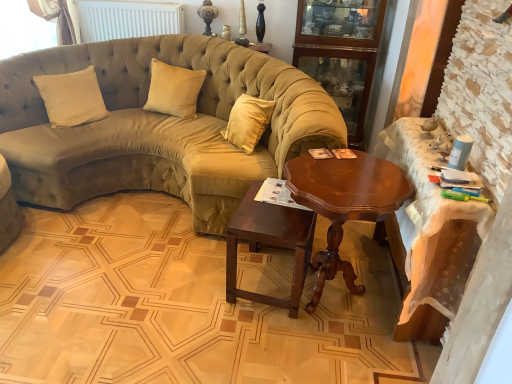
This screenshot has height=384, width=512. What do you see at coordinates (127, 19) in the screenshot?
I see `white matte radiator at upper center` at bounding box center [127, 19].

Identify the location of wooden cabinet at upper right. This screenshot has height=384, width=512. (341, 53).

The image size is (512, 384). Find the location of `velvet olive green couch at center`. velvet olive green couch at center is located at coordinates [159, 126].

Which is more to the left, wooden cabinet at upper right or shiny brown wood coffee table at center?

shiny brown wood coffee table at center.

Measure the distance between wooden cabinet at upper right and shiny brown wood coffee table at center.

1.47 meters.

Is wooden cabinet at upper right positioned beyond the bounds of shiny brown wood coffee table at center?

Yes, wooden cabinet at upper right is located beyond the bounds of shiny brown wood coffee table at center.

Considering the positions of point (320, 2) and point (371, 170), is point (320, 2) closer or farther from the camera than point (371, 170)?

Clearly, point (320, 2) is more distant from the camera than point (371, 170).

Consider the image. Which object is wider, wooden cabinet at upper right or beige velvet pillow at center, acting as the first pillow starting from the left?

wooden cabinet at upper right.

Is wooden cabinet at upper right far from beige velvet pillow at center, the 2th pillow when ordered from right to left?

Yes, wooden cabinet at upper right is far from beige velvet pillow at center, the 2th pillow when ordered from right to left.

Considering the sizes of objects wooden cabinet at upper right and beige velvet pillow at center, the 2th pillow when ordered from right to left, in the image provided, who is smaller, wooden cabinet at upper right or beige velvet pillow at center, the 2th pillow when ordered from right to left,?

With smaller size is beige velvet pillow at center, the 2th pillow when ordered from right to left.

Relative to shiny brown wood coffee table at center, is wooden table at right, the first table in the right-to-left sequence, in front or behind?

Visually, wooden table at right, the first table in the right-to-left sequence, is located in front of shiny brown wood coffee table at center.

Visually, is wooden table at right, the first table in the right-to-left sequence, positioned to the left or to the right of shiny brown wood coffee table at center?

wooden table at right, the first table in the right-to-left sequence, is positioned on shiny brown wood coffee table at center's right side.

From the image's perspective, between wooden table at right, arranged as the 2th table when viewed from the left, and shiny brown wood coffee table at center, who is located below?

shiny brown wood coffee table at center appears lower in the image.

Is wooden table at right, the first table in the right-to-left sequence, positioned beyond the bounds of shiny brown wood coffee table at center?

That's correct, wooden table at right, the first table in the right-to-left sequence, is outside of shiny brown wood coffee table at center.

Considering the relative positions of satin beige pillow at center, placed as the 1th pillow when sorted from right to left, and white matte radiator at upper center in the image provided, is satin beige pillow at center, placed as the 1th pillow when sorted from right to left, to the left or to the right of white matte radiator at upper center?

In the image, satin beige pillow at center, placed as the 1th pillow when sorted from right to left, appears on the right side of white matte radiator at upper center.

Measure the distance from satin beige pillow at center, positioned as the second pillow in left-to-right order, to white matte radiator at upper center.

The distance of satin beige pillow at center, positioned as the second pillow in left-to-right order, from white matte radiator at upper center is 27.42 inches.

Does point (170, 107) come farther from viewer compared to point (103, 12)?

No, (170, 107) is in front of (103, 12).

Is satin beige pillow at center, positioned as the second pillow in left-to-right order, next to white matte radiator at upper center?

No, satin beige pillow at center, positioned as the second pillow in left-to-right order, is not touching white matte radiator at upper center.

Considering the points (402, 178) and (357, 36), which point is behind, point (402, 178) or point (357, 36)?

The point (357, 36) is farther from the camera.

From a real-world perspective, is shiny brown wood coffee table at center on top of wooden cabinet at upper right?

No, from a real-world perspective, shiny brown wood coffee table at center is not on top of wooden cabinet at upper right.

I want to click on coffee table below the wooden cabinet at upper right (from a real-world perspective), so click(344, 203).

Measure the distance from shiny brown wood coffee table at center to wooden cabinet at upper right.

They are 4.81 feet apart.

Which of these two, satin beige pillow at center, positioned as the second pillow in left-to-right order, or beige velvet pillow at center, the 2th pillow when ordered from right to left, stands shorter?

satin beige pillow at center, positioned as the second pillow in left-to-right order, is shorter.

From a real-world perspective, which object rests below the other?

From a 3D spatial view, beige velvet pillow at center, acting as the first pillow starting from the left, is below.

Which point is more distant from viewer, (176, 89) or (71, 95)?

The point (176, 89) is farther from the camera.

Which object is more forward, satin beige pillow at center, placed as the 1th pillow when sorted from right to left, or beige velvet pillow at center, acting as the first pillow starting from the left?

beige velvet pillow at center, acting as the first pillow starting from the left, is in front.

From the picture: Is mahogany wood side table at center, marked as the 1th table in a left-to-right arrangement, touching satin beige pillow at center, placed as the 1th pillow when sorted from right to left?

No, mahogany wood side table at center, marked as the 1th table in a left-to-right arrangement, is not beside satin beige pillow at center, placed as the 1th pillow when sorted from right to left.

Can you tell me how much mahogany wood side table at center, marked as the 1th table in a left-to-right arrangement, and satin beige pillow at center, positioned as the second pillow in left-to-right order, differ in facing direction?

The facing directions of mahogany wood side table at center, marked as the 1th table in a left-to-right arrangement, and satin beige pillow at center, positioned as the second pillow in left-to-right order, are 93.4 degrees apart.

Is mahogany wood side table at center, acting as the second table starting from the right, inside the boundaries of satin beige pillow at center, placed as the 1th pillow when sorted from right to left, or outside?

The correct answer is: outside.

Considering the relative sizes of mahogany wood side table at center, acting as the second table starting from the right, and satin beige pillow at center, placed as the 1th pillow when sorted from right to left, in the image provided, is mahogany wood side table at center, acting as the second table starting from the right, bigger than satin beige pillow at center, placed as the 1th pillow when sorted from right to left,?

Indeed, mahogany wood side table at center, acting as the second table starting from the right, has a larger size compared to satin beige pillow at center, placed as the 1th pillow when sorted from right to left.

What are the coordinates of `bookshelf above the shiny brown wood coffee table at center (from the image's perspective)` in the screenshot? It's located at (341, 53).

At what (x,y) coordinates should I click in order to perform the action: click on the 2nd pillow in front of the wooden cabinet at upper right. Please return your answer as a coordinate pair (x, y). Looking at the image, I should click on (72, 97).

Which object lies nearer to the anchor point wooden table at right, arranged as the 2th table when viewed from the left, wooden cabinet at upper right or velvet olive green couch at center?

velvet olive green couch at center lies closer to wooden table at right, arranged as the 2th table when viewed from the left, than the other object.

Consider the image. Based on their spatial positions, is satin beige pillow at center, positioned as the second pillow in left-to-right order, or white matte radiator at upper center further from wooden table at right, arranged as the 2th table when viewed from the left?

white matte radiator at upper center is further to wooden table at right, arranged as the 2th table when viewed from the left.

When comparing their distances from wooden table at right, the first table in the right-to-left sequence, does white matte radiator at upper center or wooden cabinet at upper right seem further?

Based on the image, white matte radiator at upper center appears to be further to wooden table at right, the first table in the right-to-left sequence.

Looking at the image, which one is located further to satin beige pillow at center, positioned as the second pillow in left-to-right order, beige velvet pillow at center, the 2th pillow when ordered from right to left, or white matte radiator at upper center?

Among the two, white matte radiator at upper center is located further to satin beige pillow at center, positioned as the second pillow in left-to-right order.

Considering their positions, is mahogany wood side table at center, acting as the second table starting from the right, positioned closer to beige velvet pillow at center, the 2th pillow when ordered from right to left, than shiny brown wood coffee table at center?

mahogany wood side table at center, acting as the second table starting from the right, is positioned closer to the anchor beige velvet pillow at center, the 2th pillow when ordered from right to left.

From the picture: From the image, which object appears to be farther from mahogany wood side table at center, marked as the 1th table in a left-to-right arrangement, white matte radiator at upper center or beige velvet pillow at center, acting as the first pillow starting from the left?

Based on the image, white matte radiator at upper center appears to be further to mahogany wood side table at center, marked as the 1th table in a left-to-right arrangement.

Looking at the image, which one is located further to velvet olive green couch at center, mahogany wood side table at center, acting as the second table starting from the right, or wooden cabinet at upper right?

wooden cabinet at upper right lies further to velvet olive green couch at center than the other object.

Considering their positions, is mahogany wood side table at center, acting as the second table starting from the right, positioned further to velvet olive green couch at center than shiny brown wood coffee table at center?

Among the two, shiny brown wood coffee table at center is located further to velvet olive green couch at center.

The height and width of the screenshot is (384, 512). I want to click on studio couch between shiny brown wood coffee table at center and satin beige pillow at center, positioned as the second pillow in left-to-right order, in the front-back direction, so click(x=159, y=126).

Locate an element on the screen. The image size is (512, 384). radiator between beige velvet pillow at center, the 2th pillow when ordered from right to left, and wooden cabinet at upper right from left to right is located at coordinates (127, 19).

The height and width of the screenshot is (384, 512). What are the coordinates of `coffee table between beige velvet pillow at center, acting as the first pillow starting from the left, and wooden table at right, the first table in the right-to-left sequence` in the screenshot? It's located at (344, 203).

Where is `table located between velvet olive green couch at center and wooden cabinet at upper right in the left-right direction`? table located between velvet olive green couch at center and wooden cabinet at upper right in the left-right direction is located at coordinates (269, 244).